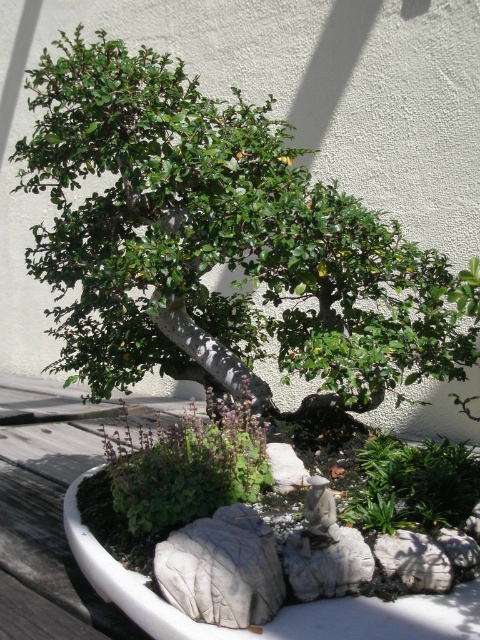
Does green leafy bonsai at center appear under green leafy plant at center?

No.

Between green leafy bonsai at center and green leafy plant at center, which one is positioned higher?

green leafy bonsai at center is higher up.

Between point (187, 180) and point (200, 515), which one is positioned in front?

Point (200, 515)

The width and height of the screenshot is (480, 640). I want to click on green leafy bonsai at center, so click(217, 243).